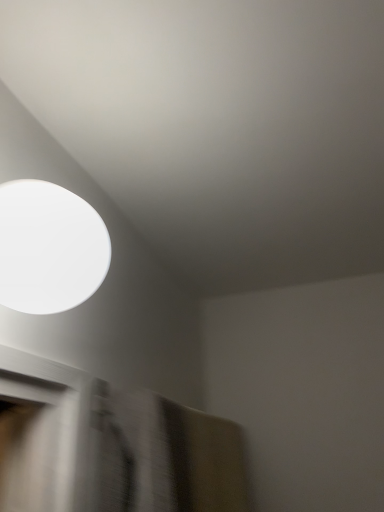
The height and width of the screenshot is (512, 384). What do you see at coordinates (49, 248) in the screenshot? I see `white matte lampshade at upper left` at bounding box center [49, 248].

What is the approximate height of white matte lampshade at upper left?

white matte lampshade at upper left is 6.32 inches tall.

What are the coordinates of `white matte lampshade at upper left` in the screenshot? It's located at (49, 248).

The height and width of the screenshot is (512, 384). I want to click on white matte lampshade at upper left, so click(x=49, y=248).